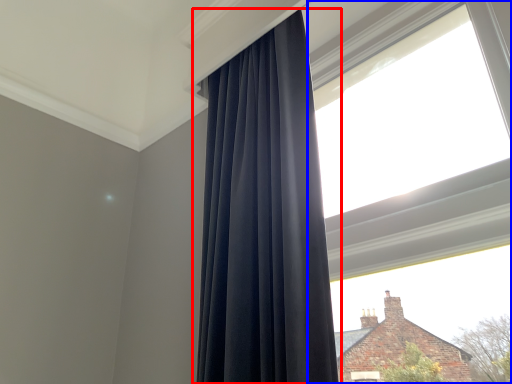
Question: Which object appears farthest to the camera in this image, curtain (highlighted by a red box) or window (highlighted by a blue box)?

Choices:
 (A) curtain
 (B) window

Answer: (A)